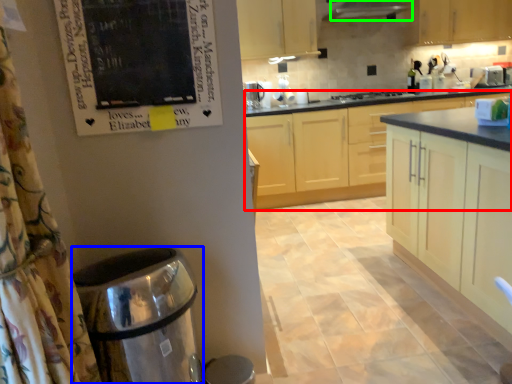
Question: Estimate the real-world distances between objects in this image. Which object is farther from cabinetry (highlighted by a red box), water heater (highlighted by a blue box) or exhaust hood (highlighted by a green box)?

Choices:
 (A) water heater
 (B) exhaust hood

Answer: (A)